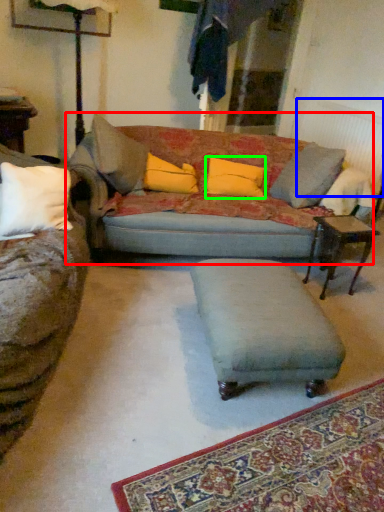
Question: Considering the real-world distances, which object is closest to studio couch (highlighted by a red box)? radiator (highlighted by a blue box) or pillow (highlighted by a green box).

Choices:
 (A) radiator
 (B) pillow

Answer: (B)